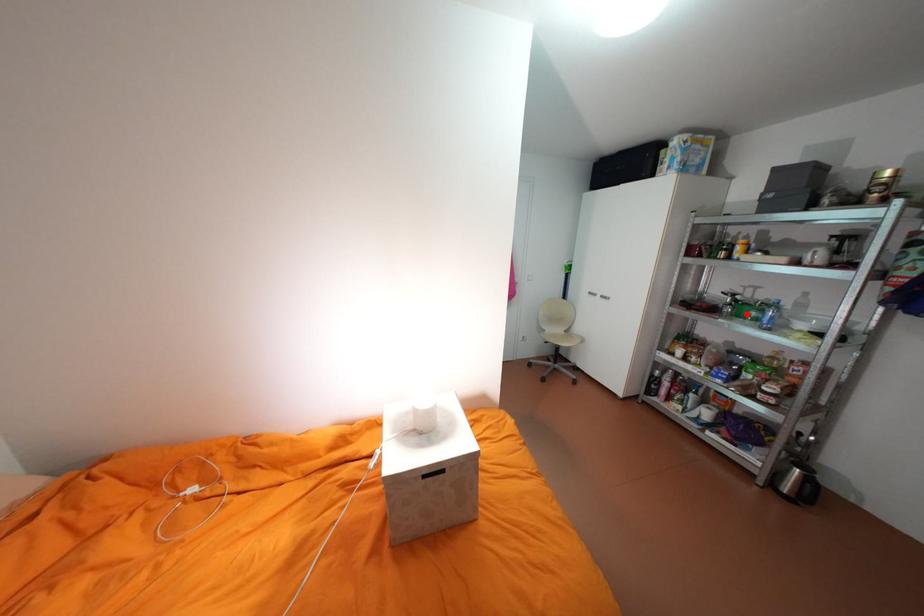
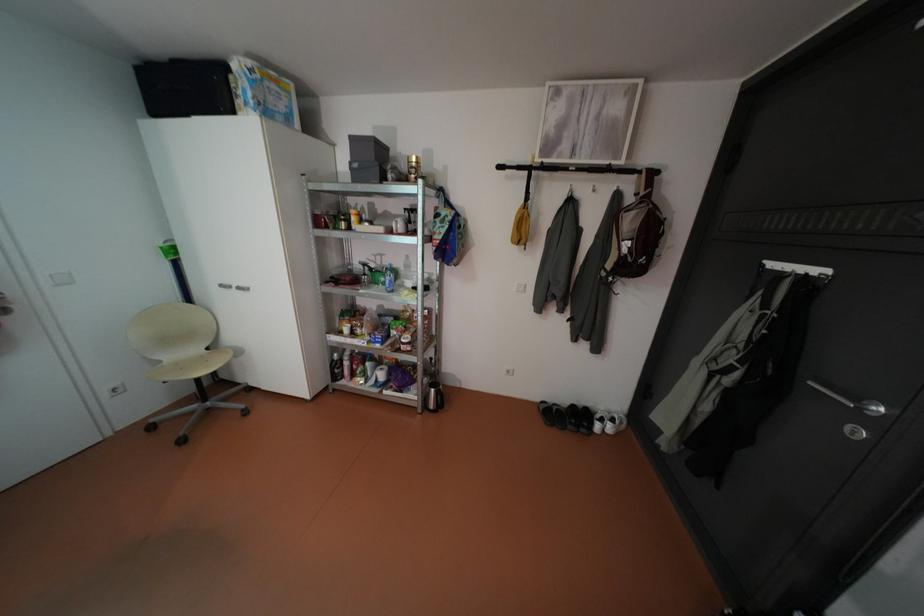
The point at the highlighted location is marked in the first image. Where is the corresponding point in the second image?

(383, 282)